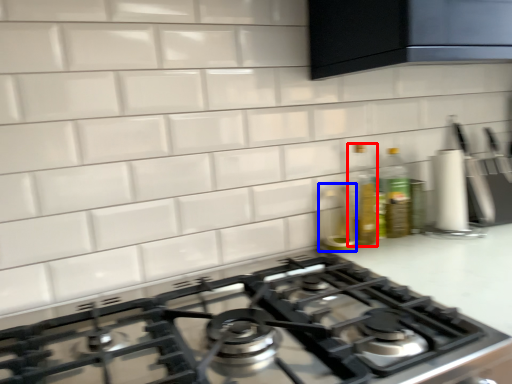
Question: Which object is further to the camera taking this photo, bottle (highlighted by a red box) or appliance (highlighted by a blue box)?

Choices:
 (A) bottle
 (B) appliance

Answer: (A)